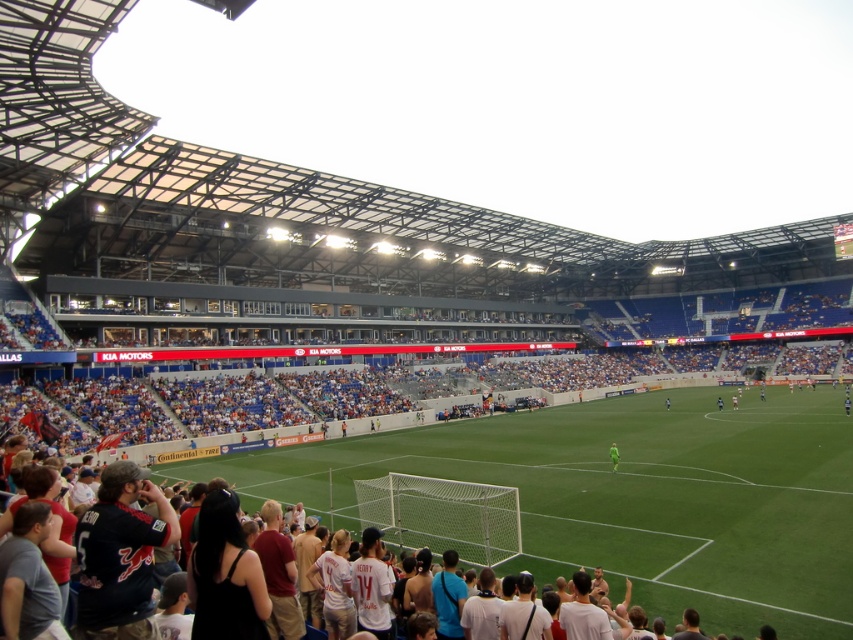
Question: Can you confirm if green grass football field at lower center is smaller than green jersey at center?

Choices:
 (A) no
 (B) yes

Answer: (A)

Question: Which object is closer to the camera taking this photo?

Choices:
 (A) green grass football field at lower center
 (B) green jersey at center

Answer: (A)

Question: Among these objects, which one is farthest from the camera?

Choices:
 (A) green grass football field at lower center
 (B) green jersey at center

Answer: (B)

Question: Can you confirm if green grass football field at lower center is smaller than green jersey at center?

Choices:
 (A) no
 (B) yes

Answer: (A)

Question: In this image, where is green grass football field at lower center located relative to green jersey at center?

Choices:
 (A) right
 (B) left

Answer: (B)